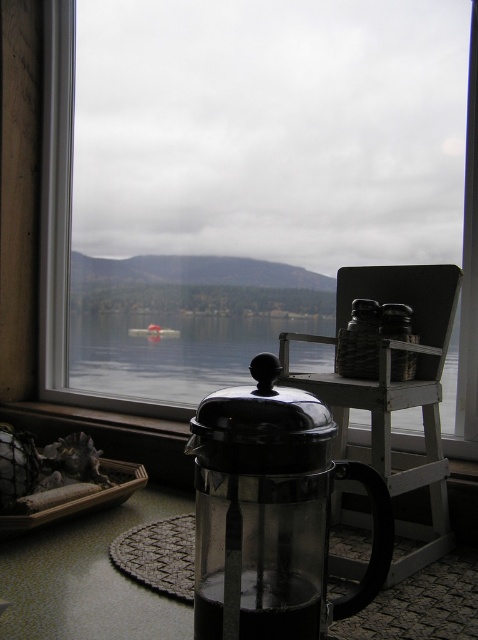
Is transparent glass window at center to the right of transparent glass water at center from the viewer's perspective?

In fact, transparent glass window at center is to the left of transparent glass water at center.

Can you confirm if transparent glass window at center is wider than transparent glass water at center?

No.

Is point (55, 12) positioned after point (412, 408)?

Yes, it is.

The height and width of the screenshot is (640, 478). Identify the location of transparent glass window at center. (65, 224).

Does wooden rocking chair at center appear over transparent glass water at center?

No.

Can you confirm if wooden rocking chair at center is positioned to the left of transparent glass water at center?

In fact, wooden rocking chair at center is to the right of transparent glass water at center.

Who is more distant from viewer, (423, 461) or (122, 396)?

Point (122, 396)

Find the location of a particular element. The width and height of the screenshot is (478, 640). wooden rocking chair at center is located at coordinates (394, 392).

Can you confirm if transparent glass french press at center is bigger than transparent glass water at center?

No.

At what (x,y) coordinates should I click in order to perform the action: click on transparent glass french press at center. Please return your answer as a coordinate pair (x, y). Looking at the image, I should click on (271, 513).

Locate an element on the screen. This screenshot has width=478, height=640. transparent glass french press at center is located at coordinates (271, 513).